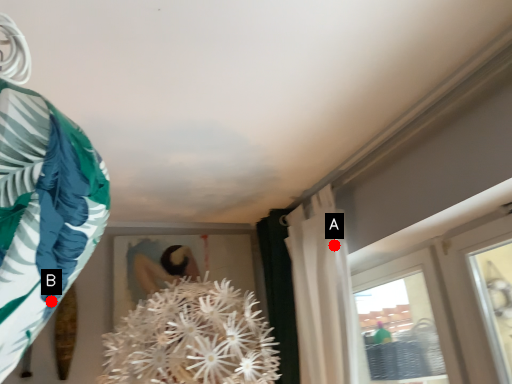
Question: Two points are circled on the image, labeled by A and B beside each circle. Which point is closer to the camera?

Choices:
 (A) A is closer
 (B) B is closer

Answer: (B)